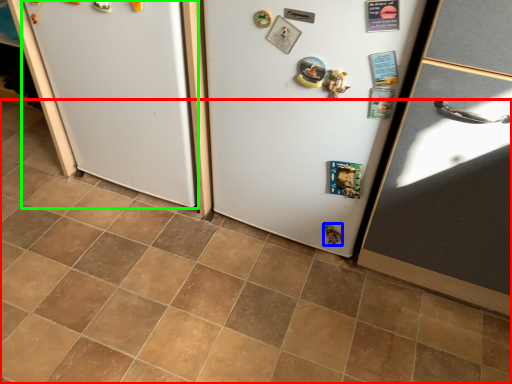
Question: Considering the real-world distances, which object is farthest from tile (highlighted by a red box)? toy (highlighted by a blue box) or fridge (highlighted by a green box)?

Choices:
 (A) toy
 (B) fridge

Answer: (A)